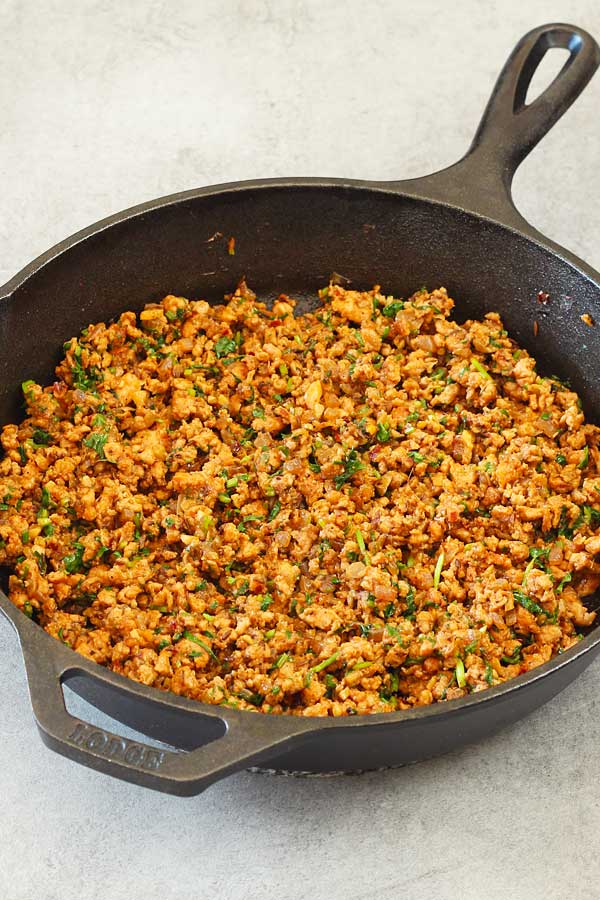
Where is `handle that you use to lift the skillet`? handle that you use to lift the skillet is located at coordinates (492, 147).